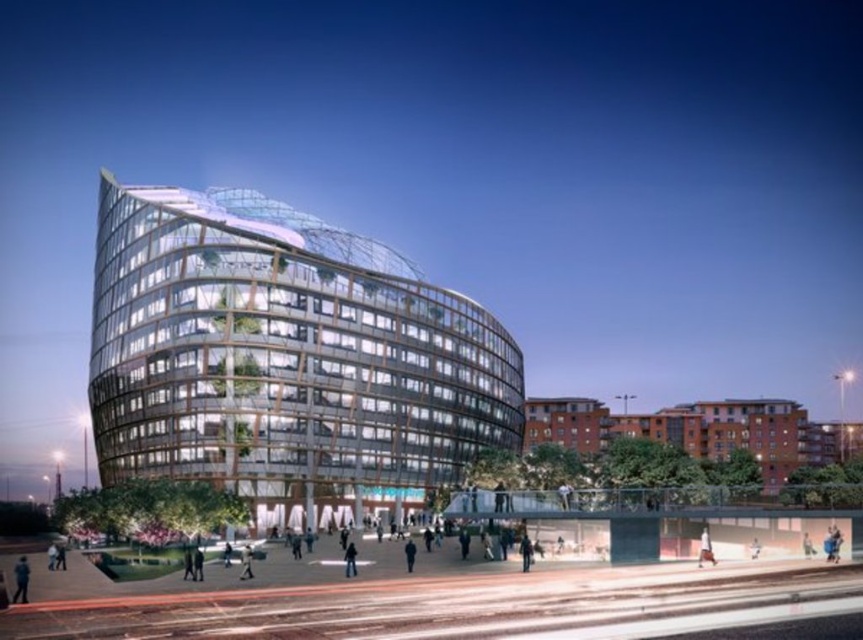
You are an architect designing a new plaza and want to ensure there is enough space between the transparent glass building at center and the light gray fabric jacket at lower center for a walkway. Based on their widths, can you confirm if the walkway can be placed between them?

The transparent glass building at center is wider than the light gray fabric jacket at lower center, so the walkway can be placed between them as there is sufficient space.

You are standing in the plaza in front of the transparent glass building at center. You see a light gray fabric jacket at lower center. Which object is higher in the image?

The transparent glass building at center is higher than the light gray fabric jacket at lower center.

You are a photographer aiming to capture both the blue fabric jacket at lower left and the dark blue fabric at center in a single frame. Since you want both to be clearly visible, which object should you focus on to ensure the larger one is in sharp focus?

The blue fabric jacket at lower left is larger in size than the dark blue fabric at center. To ensure the larger object is in sharp focus, you should focus on the blue fabric jacket at lower left.